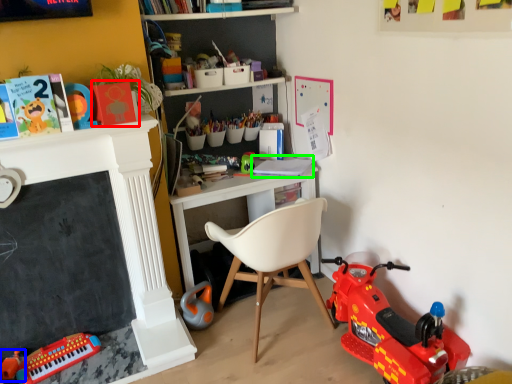
Question: Which object is the closest to the book (highlighted by a red box)? Choose among these: toy (highlighted by a blue box) or book (highlighted by a green box).

Choices:
 (A) toy
 (B) book

Answer: (B)